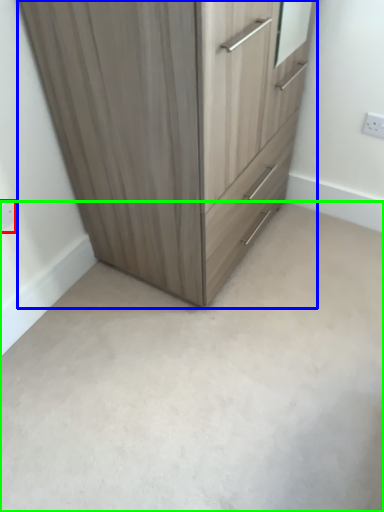
Question: Which object is positioned closest to electric outlet (highlighted by a red box)? Select from chest of drawers (highlighted by a blue box) and concrete (highlighted by a green box).

Choices:
 (A) chest of drawers
 (B) concrete

Answer: (A)